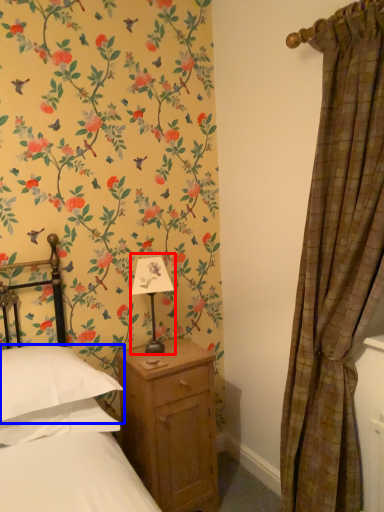
Question: Which point is further to the camera, table lamp (highlighted by a red box) or pillow (highlighted by a blue box)?

Choices:
 (A) table lamp
 (B) pillow

Answer: (A)